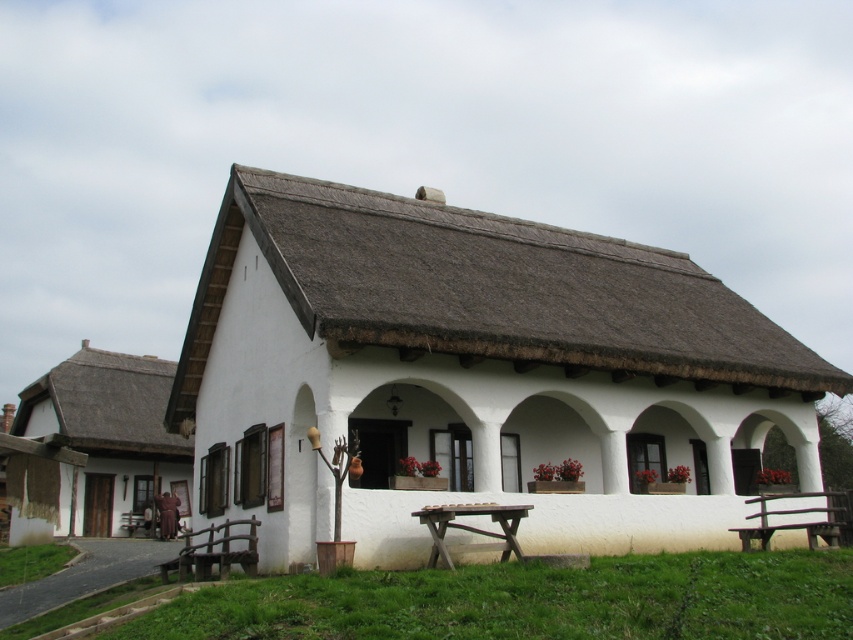
Who is more distant from viewer, (x=62, y=518) or (x=508, y=525)?

The point (x=62, y=518) is behind.

Measure the distance between white thatched roof cottage at left and brown wooden picnic table at lower center.

white thatched roof cottage at left and brown wooden picnic table at lower center are 17.79 meters apart from each other.

Is point (39, 486) closer to camera compared to point (457, 550)?

No, (39, 486) is behind (457, 550).

Locate an element on the screen. white thatched roof cottage at left is located at coordinates (93, 444).

Can you confirm if white stucco cottage at center is taller than white thatched roof cottage at left?

Yes, white stucco cottage at center is taller than white thatched roof cottage at left.

Who is more distant from viewer, (x=344, y=259) or (x=142, y=458)?

Positioned behind is point (x=142, y=458).

Locate an element on the screen. This screenshot has width=853, height=640. white stucco cottage at center is located at coordinates (474, 372).

Which of these two, white stucco cottage at center or brown wooden picnic table at lower center, stands taller?

With more height is white stucco cottage at center.

Who is positioned more to the right, white stucco cottage at center or brown wooden picnic table at lower center?

white stucco cottage at center

Between point (740, 465) and point (489, 502), which one is positioned in front?

Point (489, 502)

Locate an element on the screen. This screenshot has width=853, height=640. white stucco cottage at center is located at coordinates (474, 372).